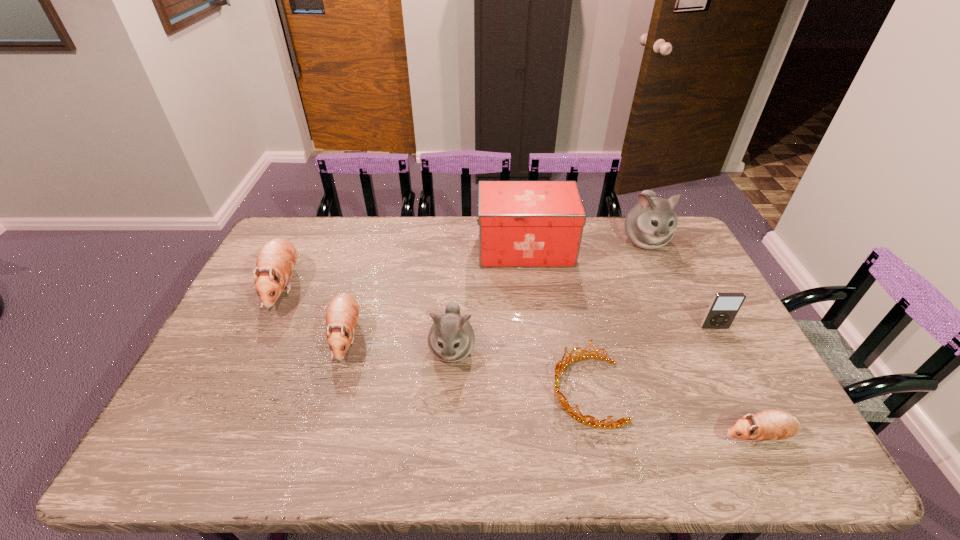
Identify the location of object that is at the left edge. Image resolution: width=960 pixels, height=540 pixels. (276, 260).

At what (x,y) coordinates should I click in order to perform the action: click on iPod at the right edge. Please return your answer as a coordinate pair (x, y). Image resolution: width=960 pixels, height=540 pixels. Looking at the image, I should click on (724, 307).

Image resolution: width=960 pixels, height=540 pixels. What are the coordinates of `object that is at the far right corner` in the screenshot? It's located at (650, 224).

Where is `object at the near right corner`? The image size is (960, 540). object at the near right corner is located at coordinates (771, 424).

Locate an element on the screen. vacant space at the far edge of the desktop is located at coordinates (608, 232).

I want to click on blank space at the near edge, so click(x=544, y=465).

In the image, there is a desktop. In order to click on free space at the right edge in this screenshot , I will do click(x=684, y=291).

The width and height of the screenshot is (960, 540). What are the coordinates of `free region at the far left corner of the desktop` in the screenshot? It's located at (321, 224).

Locate an element on the screen. vacant area at the near left corner of the desktop is located at coordinates (174, 449).

Where is `empty space that is in between the nearer white hamster and the first-aid kit`? empty space that is in between the nearer white hamster and the first-aid kit is located at coordinates (489, 299).